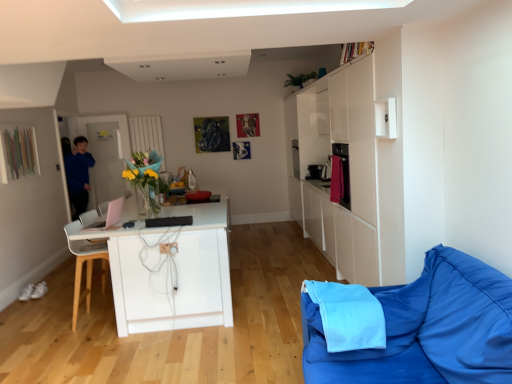
Question: Is blue fabric couch at lower right not near pink plastic laptop at center, placed as the second appliance when sorted from front to back?

Choices:
 (A) yes
 (B) no

Answer: (A)

Question: Does blue fabric couch at lower right have a lesser width compared to pink plastic laptop at center, the 1th appliance when ordered from left to right?

Choices:
 (A) no
 (B) yes

Answer: (A)

Question: Is blue fabric couch at lower right at the left side of pink plastic laptop at center, the 1th appliance when ordered from left to right?

Choices:
 (A) yes
 (B) no

Answer: (B)

Question: From a real-world perspective, is blue fabric couch at lower right under pink plastic laptop at center, the 1th appliance when ordered from back to front?

Choices:
 (A) yes
 (B) no

Answer: (A)

Question: Is blue fabric couch at lower right positioned before pink plastic laptop at center, the 1th appliance when ordered from left to right?

Choices:
 (A) yes
 (B) no

Answer: (A)

Question: Is white wooden chair at left in front of or behind blue fabric couch at lower right in the image?

Choices:
 (A) front
 (B) behind

Answer: (B)

Question: From the image's perspective, is white wooden chair at left above or below blue fabric couch at lower right?

Choices:
 (A) below
 (B) above

Answer: (B)

Question: From a real-world perspective, is white wooden chair at left positioned above or below blue fabric couch at lower right?

Choices:
 (A) above
 (B) below

Answer: (B)

Question: In terms of height, does white wooden chair at left look taller or shorter compared to blue fabric couch at lower right?

Choices:
 (A) short
 (B) tall

Answer: (B)

Question: From the image's perspective, relative to black matte speaker at center, the first appliance in the right-to-left sequence, is pink plastic laptop at center, placed as the second appliance when sorted from front to back, above or below?

Choices:
 (A) above
 (B) below

Answer: (A)

Question: Is pink plastic laptop at center, acting as the second appliance starting from the right, situated inside black matte speaker at center, the first appliance in the right-to-left sequence, or outside?

Choices:
 (A) inside
 (B) outside

Answer: (B)

Question: Considering the positions of pink plastic laptop at center, placed as the second appliance when sorted from front to back, and black matte speaker at center, which is the 1th appliance from front to back, in the image, is pink plastic laptop at center, placed as the second appliance when sorted from front to back, wider or thinner than black matte speaker at center, which is the 1th appliance from front to back,?

Choices:
 (A) wide
 (B) thin

Answer: (A)

Question: In the image, is pink plastic laptop at center, the 1th appliance when ordered from back to front, on the left side or the right side of black matte speaker at center, which is the 2th appliance from left to right?

Choices:
 (A) right
 (B) left

Answer: (B)

Question: From the image's perspective, relative to white wooden chair at left, is pink plastic laptop at center, placed as the second appliance when sorted from front to back, above or below?

Choices:
 (A) above
 (B) below

Answer: (A)

Question: Looking at the image, does pink plastic laptop at center, the 1th appliance when ordered from back to front, seem bigger or smaller compared to white wooden chair at left?

Choices:
 (A) small
 (B) big

Answer: (A)